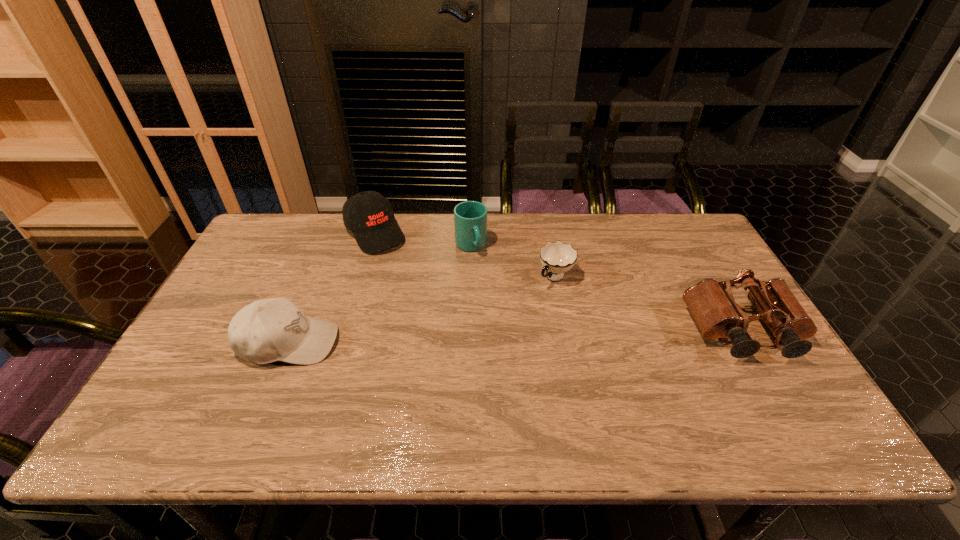
Identify the location of object that is at the right edge. Image resolution: width=960 pixels, height=540 pixels. (713, 308).

Identify the location of free region at the far edge. (576, 233).

In the image, there is a desktop. In order to click on vacant region at the near edge in this screenshot , I will do `click(335, 376)`.

This screenshot has height=540, width=960. What are the coordinates of `vacant space at the left edge of the desktop` in the screenshot? It's located at (207, 318).

At what (x,y) coordinates should I click in order to perform the action: click on vacant area at the near right corner. Please return your answer as a coordinate pair (x, y). The image size is (960, 540). Looking at the image, I should click on (744, 407).

Locate an element on the screen. vacant point located between the farther baseball cap and the left cup is located at coordinates (423, 239).

The height and width of the screenshot is (540, 960). I want to click on empty space between the farther baseball cap and the binoculars, so click(559, 282).

Where is `blank region between the nearer baseball cap and the binoculars`? The image size is (960, 540). blank region between the nearer baseball cap and the binoculars is located at coordinates (516, 337).

Locate an element on the screen. This screenshot has width=960, height=540. free space between the shorter cup and the farther baseball cap is located at coordinates (466, 255).

In order to click on free space between the rightmost object and the farther baseball cap in this screenshot , I will do `click(559, 282)`.